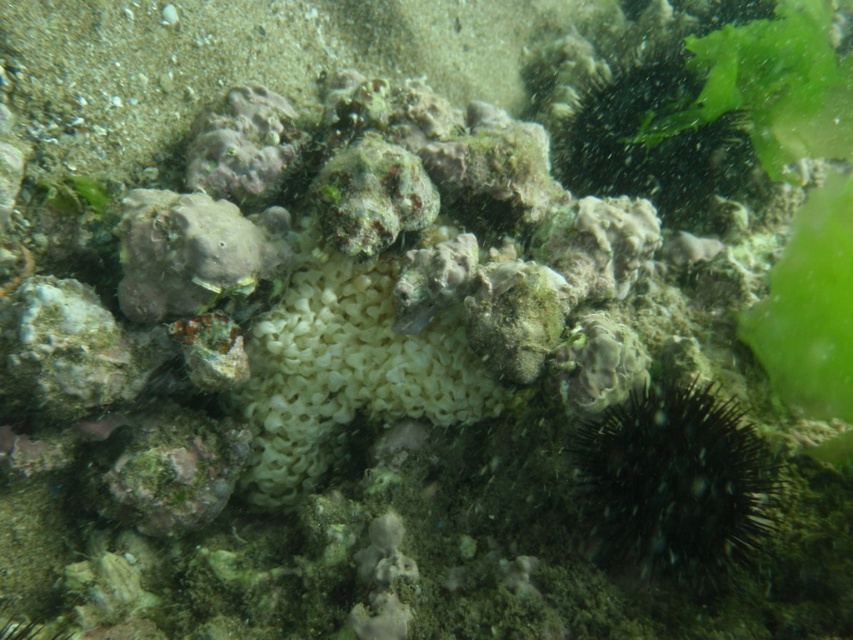
Locate an element on the screen. The width and height of the screenshot is (853, 640). black spiny sea urchin at lower right is located at coordinates (675, 483).

Does black spiny sea urchin at lower right lie in front of white sponge at center?

Yes, it is in front of white sponge at center.

The width and height of the screenshot is (853, 640). I want to click on black spiny sea urchin at lower right, so click(x=675, y=483).

Locate an element on the screen. The height and width of the screenshot is (640, 853). black spiny sea urchin at lower right is located at coordinates (675, 483).